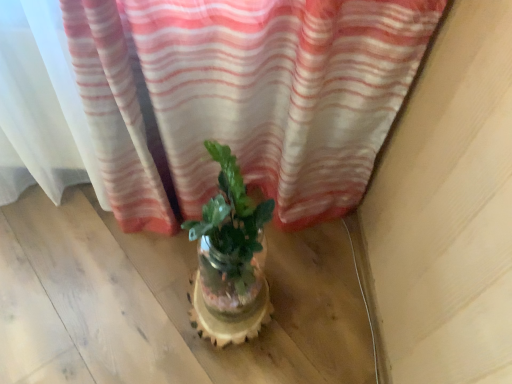
You are a GUI agent. You are given a task and a screenshot of the screen. Output one action in this format:
    pyautogui.click(x=<x>, y=<y>)
    Task: Click on the translucent glass vase at center
    Image resolution: width=512 pixels, height=384 pixels.
    Given the screenshot: What is the action you would take?
    pyautogui.click(x=230, y=258)

What do you see at coordinates (230, 258) in the screenshot? The height and width of the screenshot is (384, 512). I see `translucent glass vase at center` at bounding box center [230, 258].

You are a GUI agent. You are given a task and a screenshot of the screen. Output one action in this format:
    pyautogui.click(x=<x>, y=<y>)
    Task: Click on the translucent glass vase at center
    This screenshot has width=512, height=384.
    Given the screenshot: What is the action you would take?
    pyautogui.click(x=230, y=258)